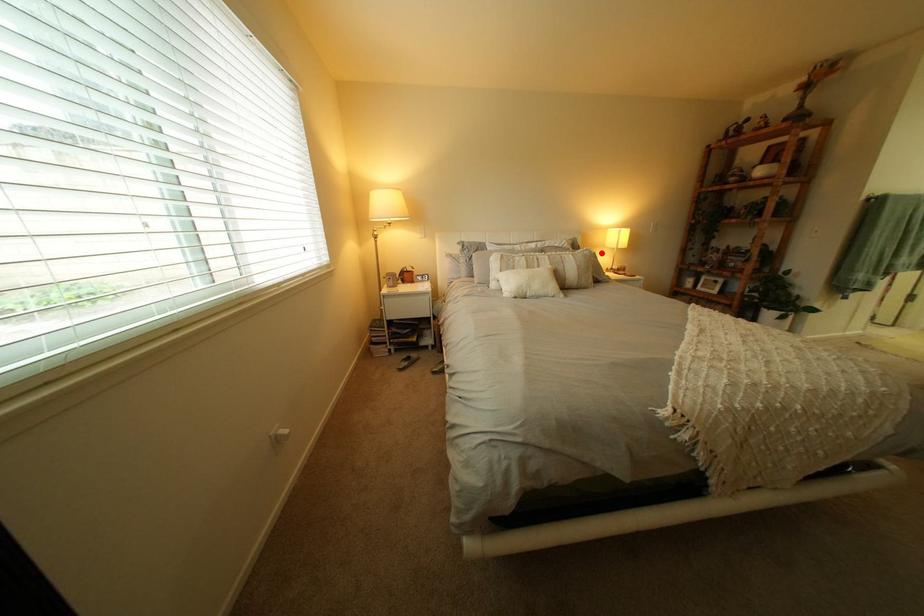
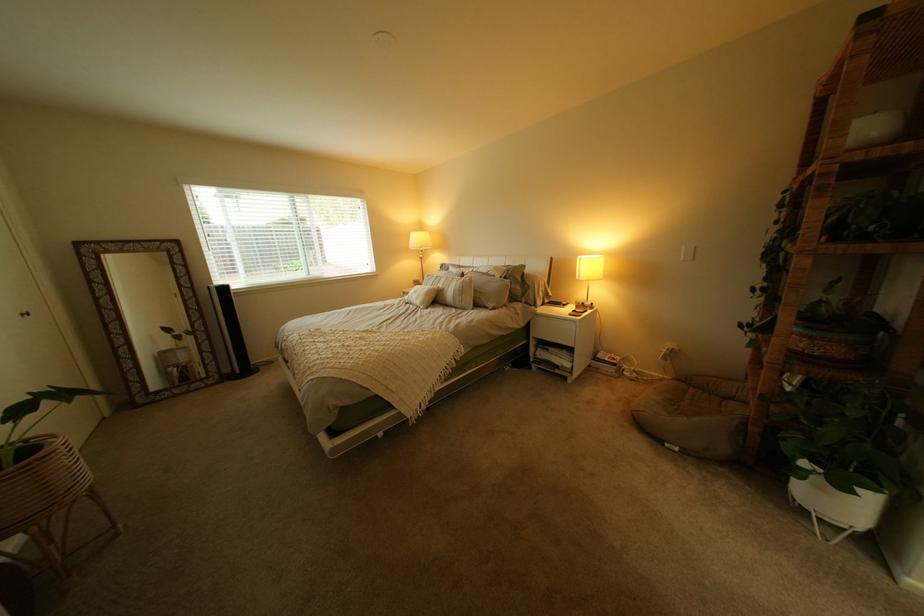
Where in the second image is the point corresponding to the highlighted location from the first image?

(482, 280)